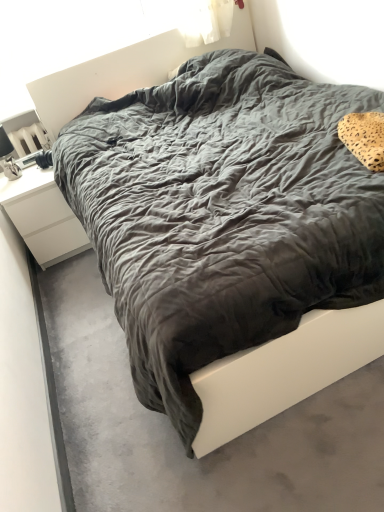
Question: Considering the positions of point (317, 392) and point (34, 175), is point (317, 392) closer or farther from the camera than point (34, 175)?

Choices:
 (A) farther
 (B) closer

Answer: (B)

Question: Is dark gray fabric bed at center wider or thinner than white matte nightstand at left?

Choices:
 (A) thin
 (B) wide

Answer: (B)

Question: Which object is the closest to the leopard print fabric pillow at upper right?

Choices:
 (A) dark gray fabric bed at center
 (B) white matte nightstand at left

Answer: (A)

Question: Which object is positioned farthest from the leopard print fabric pillow at upper right?

Choices:
 (A) dark gray fabric bed at center
 (B) white matte nightstand at left

Answer: (B)